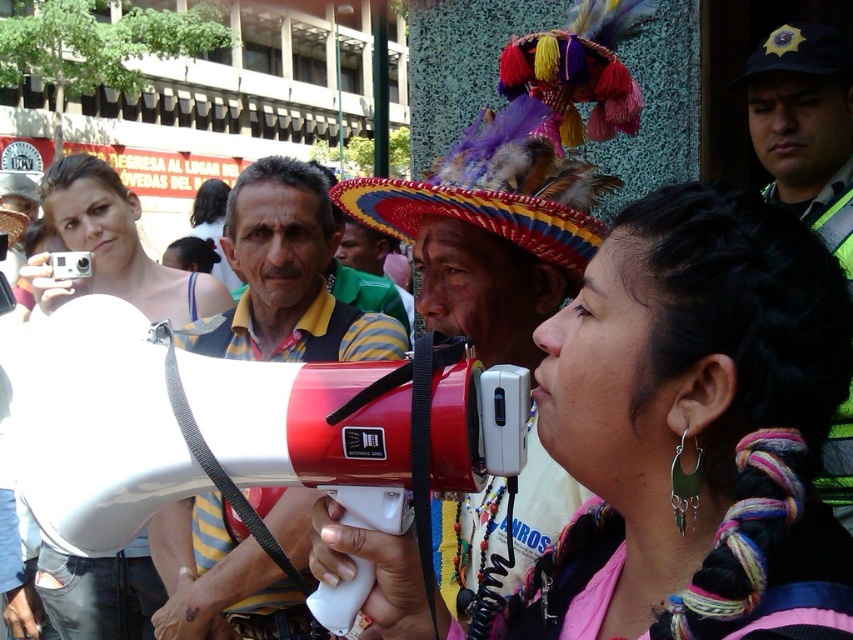
Is red plastic megaphone at center wider than multicolored feathered hat at center?

Incorrect, red plastic megaphone at center's width does not surpass multicolored feathered hat at center's.

Image resolution: width=853 pixels, height=640 pixels. What do you see at coordinates (289, 275) in the screenshot? I see `red plastic megaphone at center` at bounding box center [289, 275].

Is point (227, 547) closer to viewer compared to point (561, 163)?

No, (227, 547) is behind (561, 163).

You are a GUI agent. You are given a task and a screenshot of the screen. Output one action in this format:
    pyautogui.click(x=<x>, y=<y>)
    Task: Click on the red plastic megaphone at center
    
    Given the screenshot: What is the action you would take?
    pyautogui.click(x=289, y=275)

Is matte white megaphone at center thinner than reflective silver helmet at upper right?

Incorrect, matte white megaphone at center's width is not less than reflective silver helmet at upper right's.

Between matte white megaphone at center and reflective silver helmet at upper right, which one has less height?

reflective silver helmet at upper right is shorter.

Who is more distant from viewer, (219,308) or (837,486)?

The point (219,308) is behind.

Locate an element on the screen. The width and height of the screenshot is (853, 640). matte white megaphone at center is located at coordinates (112, 248).

Does multicolored feathered hat at center appear over matte white megaphone at center?

Yes, multicolored feathered hat at center is above matte white megaphone at center.

Which is behind, point (502, 52) or point (165, 304)?

Positioned behind is point (165, 304).

At what (x,y) coordinates should I click in order to perform the action: click on multicolored feathered hat at center. Please return your answer as a coordinate pair (x, y). The image size is (853, 640). Looking at the image, I should click on (527, 140).